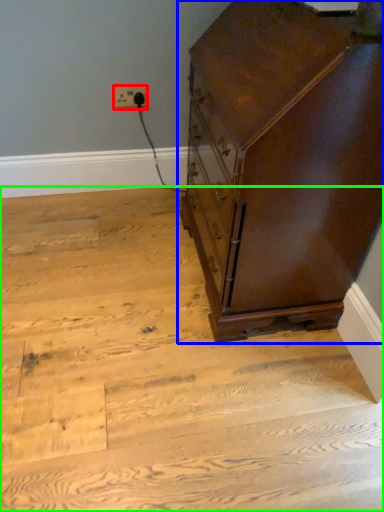
Question: Which object is positioned farthest from electric outlet (highlighted by a red box)? Select from chest of drawers (highlighted by a blue box) and stairwell (highlighted by a green box).

Choices:
 (A) chest of drawers
 (B) stairwell

Answer: (B)